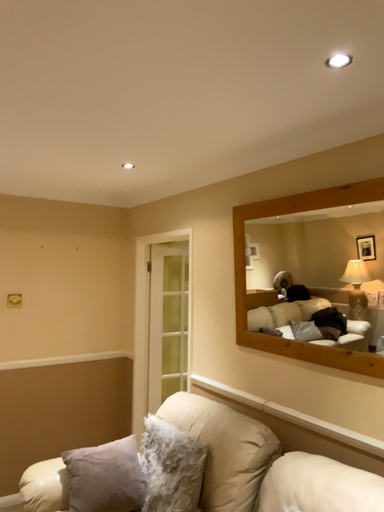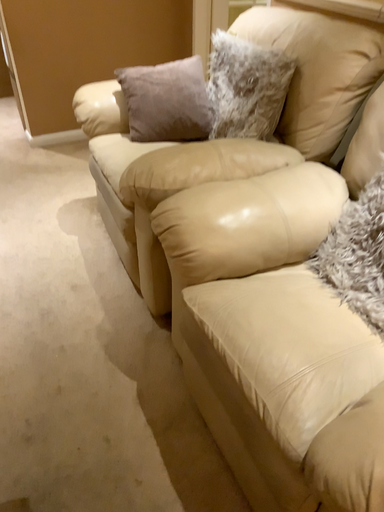
Question: How did the camera likely rotate when shooting the video?

Choices:
 (A) rotated downward
 (B) rotated upward

Answer: (A)